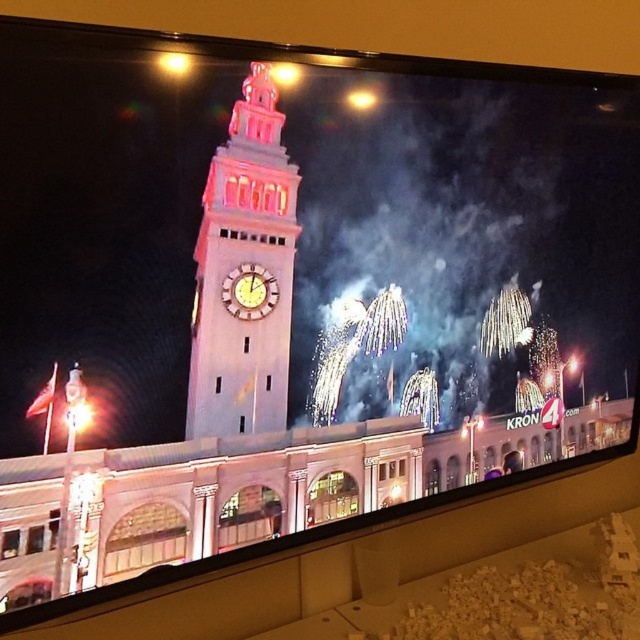
You are standing in front of the television screen showing the nighttime scene with the clock tower and fireworks. There are two points marked on the screen at coordinates point (202, 314) and point (252, 284). If you were to walk towards the television screen, which point would appear closer to you?

Point (202, 314) is in front of point (252, 284), so it would appear closer to you as you walk towards the television screen.

You are watching a live broadcast on the television screen. You notice two objects at the center of the screen. One is the white stone clock tower at center and the other is the gold metallic clock at center. Which of these two is larger in size?

The white stone clock tower at center is bigger than the gold metallic clock at center, so the white stone clock tower at center is larger in size.

You are standing in front of the TV screen watching the fireworks display. There is a point marked at coordinates point [237,192]. Can you reach this point with your hand without moving your body?

The point [237,192] is 1.12 meters away from the viewer. Since the average arm length is about 0.7 meters, you cannot reach it with your hand without moving your body.